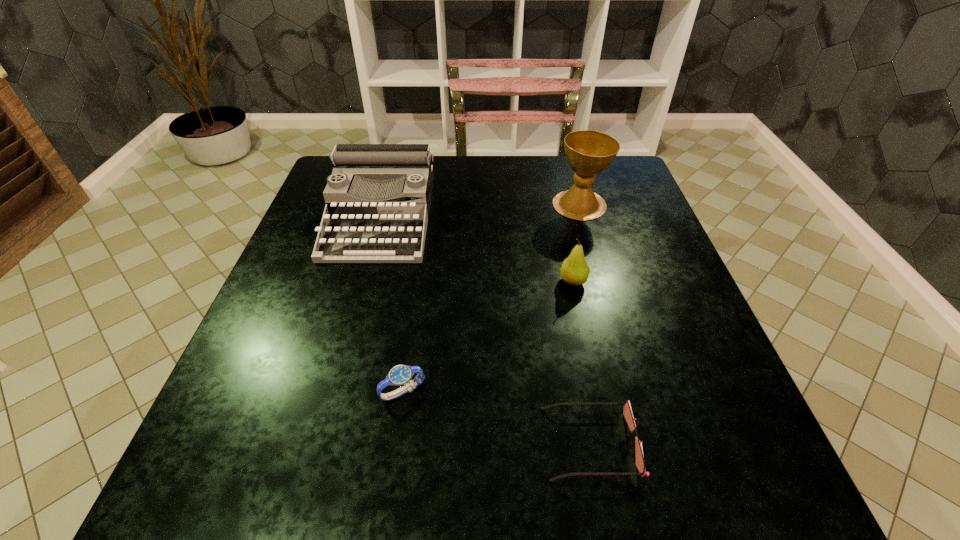
Locate an element on the screen. vacant area that lies between the typewriter and the chalice is located at coordinates (480, 210).

Locate an element on the screen. free area in between the typewriter and the third farthest object is located at coordinates (477, 248).

Identify the location of free area in between the pear and the watch. (488, 336).

Where is `vacant area between the typewriter and the shortest object`? This screenshot has height=540, width=960. vacant area between the typewriter and the shortest object is located at coordinates (486, 329).

Locate an element on the screen. This screenshot has height=540, width=960. empty space between the third nearest object and the shortest object is located at coordinates (582, 362).

Identify which object is located as the third nearest to the nearest object. Please provide its 2D coordinates. Your answer should be formatted as a tuple, i.e. [(x, y)], where the tuple contains the x and y coordinates of a point satisfying the conditions above.

[(378, 195)]

Find the location of `object that stands as the third closest to the pear`. object that stands as the third closest to the pear is located at coordinates (378, 195).

At what (x,y) coordinates should I click in order to perform the action: click on vacant space that satisfies the following two spatial constraints: 1. on the back side of the fourth farthest object; 2. on the right side of the pear. Please return your answer as a coordinate pair (x, y). The image size is (960, 540). Looking at the image, I should click on (419, 281).

The image size is (960, 540). In order to click on vacant space that satisfies the following two spatial constraints: 1. on the typing side of the typewriter; 2. on the left side of the watch in this screenshot , I will do [332, 392].

I want to click on vacant point that satisfies the following two spatial constraints: 1. on the back side of the third farthest object; 2. on the right side of the chalice, so click(557, 205).